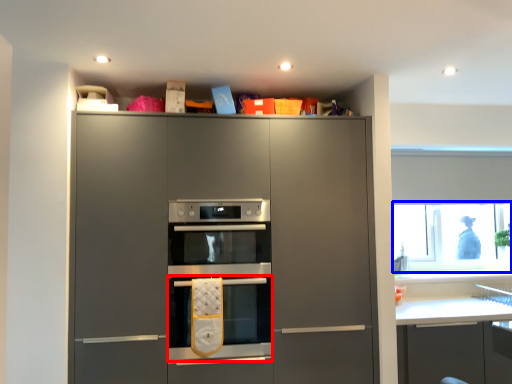
Question: Which object appears closest to the camera in this image, oven (highlighted by a red box) or window screen (highlighted by a blue box)?

Choices:
 (A) oven
 (B) window screen

Answer: (A)